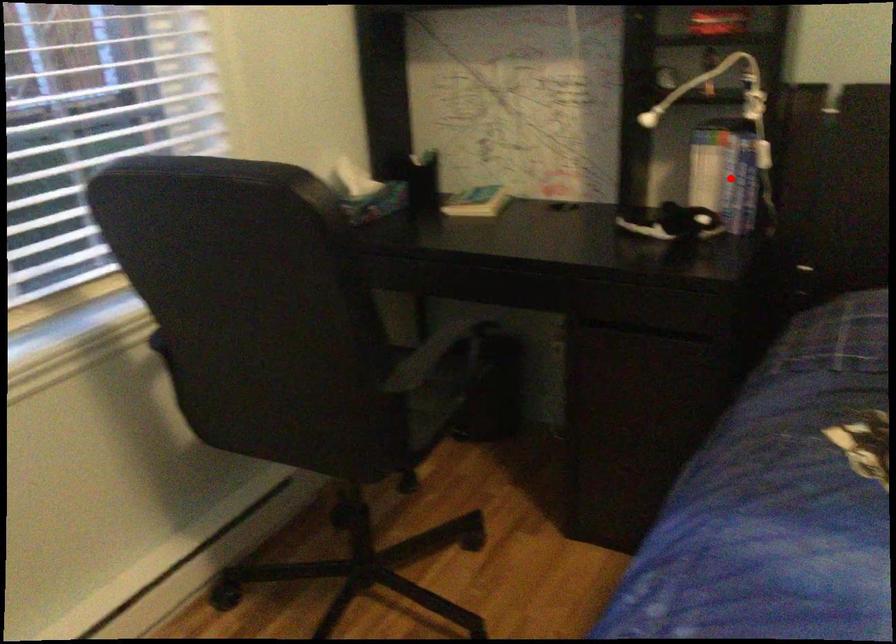
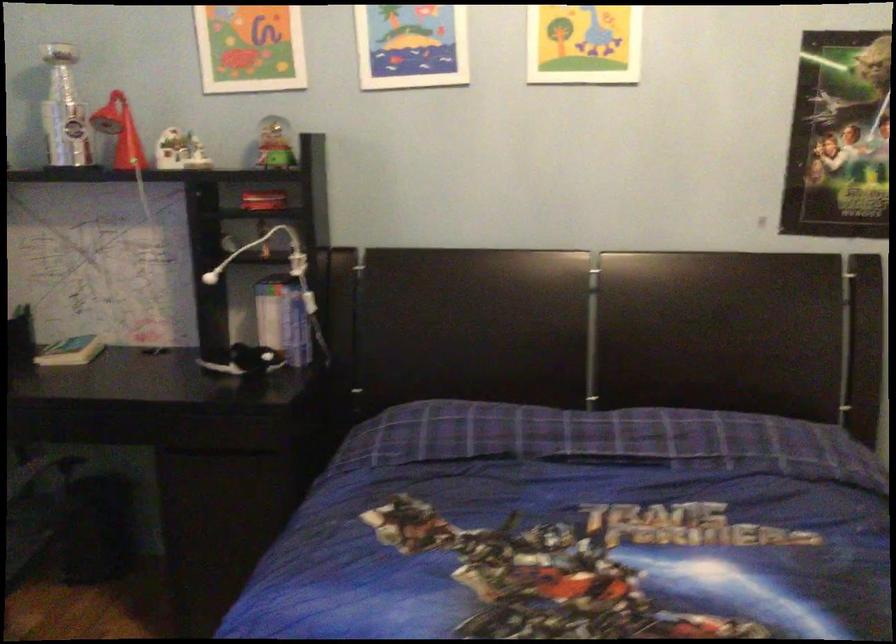
Question: I am providing you with two images of the same scene from different viewpoints. Given a red point in image1, look at the same physical point in image2. Is it:

Choices:
 (A) Closer to the viewpoint
 (B) Farther from the viewpoint

Answer: (B)